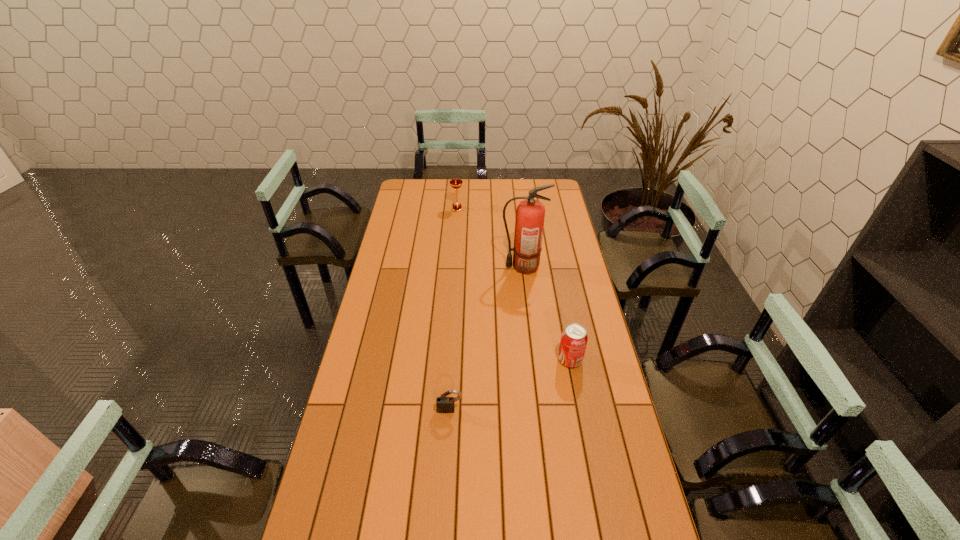
This screenshot has width=960, height=540. I want to click on the tallest object, so click(x=529, y=222).

Locate an element on the screen. the third nearest object is located at coordinates (529, 222).

Image resolution: width=960 pixels, height=540 pixels. I want to click on the farthest object, so click(455, 183).

I want to click on soda, so click(574, 337).

The image size is (960, 540). What are the coordinates of `the nearest object` in the screenshot? It's located at (443, 403).

Where is `the shortest object`? The width and height of the screenshot is (960, 540). the shortest object is located at coordinates (443, 403).

Locate an element on the screen. This screenshot has height=540, width=960. vacant space located on the nozzle of the second farthest object is located at coordinates (419, 267).

Identify the location of free space located on the nozzle of the second farthest object. (417, 267).

Image resolution: width=960 pixels, height=540 pixels. Identify the location of free space located on the nozzle of the second farthest object. (455, 267).

Identify the location of vacant area situated on the left of the farthest object. The image size is (960, 540). (408, 209).